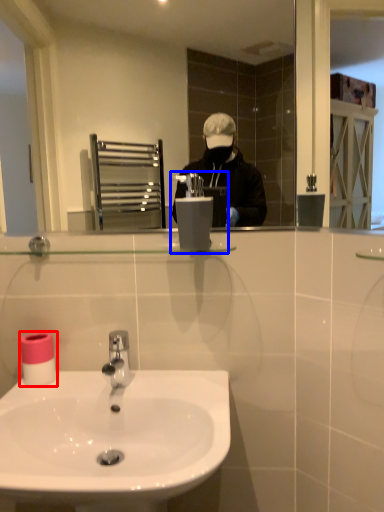
Question: Which object is closer to the camera taking this photo, toilet paper (highlighted by a red box) or hand dryer (highlighted by a blue box)?

Choices:
 (A) toilet paper
 (B) hand dryer

Answer: (B)